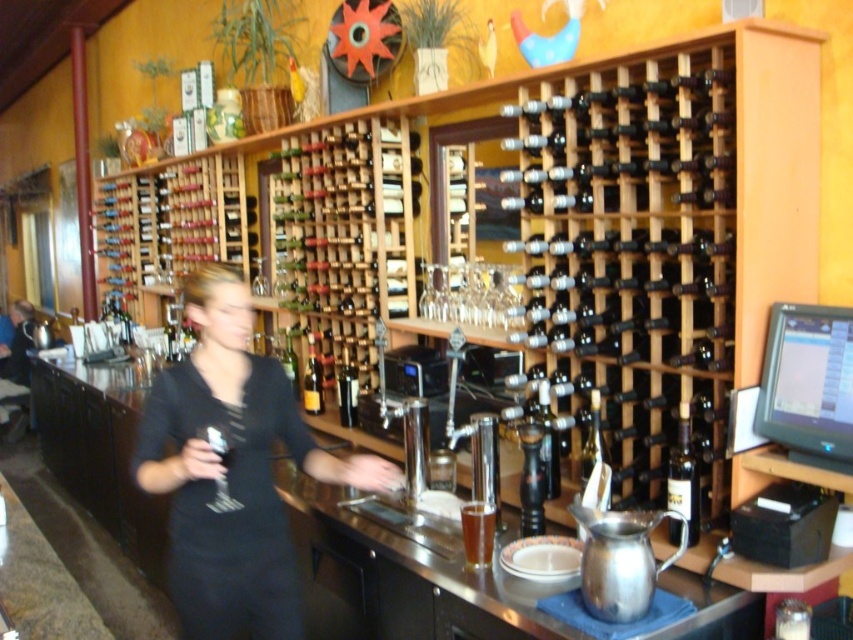
You are a customer at the bar and want to grab the clear glass wine glass at center. The bartender in the matte black shirt at left is moving towards you. How far apart are you and the bartender when you both start moving towards the glass?

The matte black shirt at left is 19.41 feet away from clear glass wine glass at center, so you and the bartender are 19.41 feet apart when starting to move towards the glass.